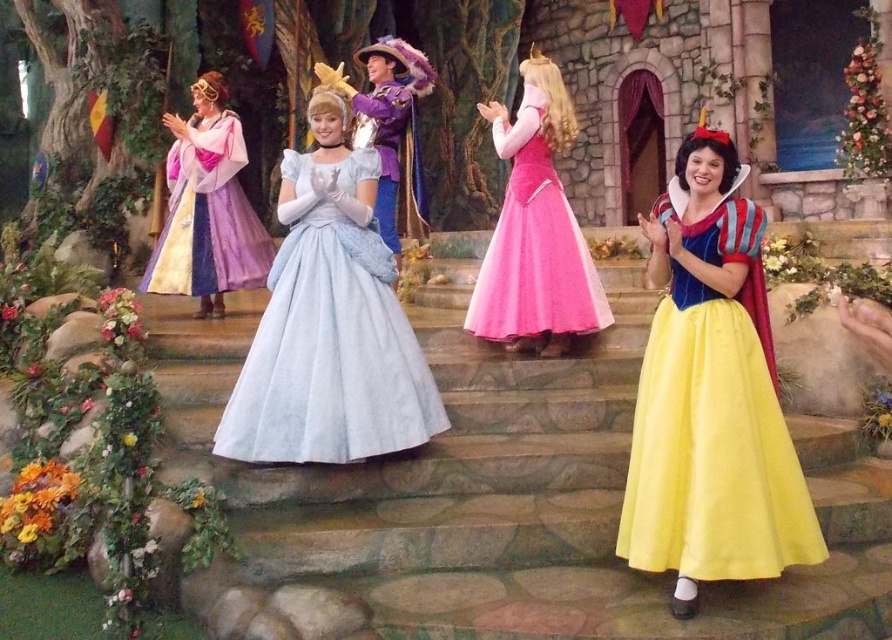
You are a costume designer who needs to adjust the size of the yellow satin dress at lower right and the light blue satin dress at center to ensure they are the same size. Which dress requires more fabric to be added?

The yellow satin dress at lower right requires more fabric to be added since it has a smaller size compared to the light blue satin dress at center.

In the scene described, there are two characters wearing satin dresses. The light blue satin dress at center and the pastel purple satin dress at left. From the perspective of someone standing at the base of the stone steps, which dress is positioned to the right?

The light blue satin dress at center is to the right of the pastel purple satin dress at left, so from the base of the stone steps, the light blue satin dress at center is positioned to the right.

You are standing on the stage and want to hand a bouquet to the character in the yellow satin dress at lower right. Based on their position, which direction should you move to reach them?

The yellow satin dress at lower right is located at point (713, 420), so you should move towards the lower right direction to reach them.